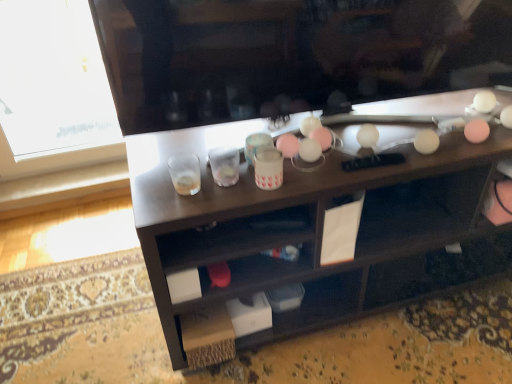
Identify the location of unoccupied area behind clear plastic shot glass at center, the 1th shot glass from the right. The height and width of the screenshot is (384, 512). (208, 142).